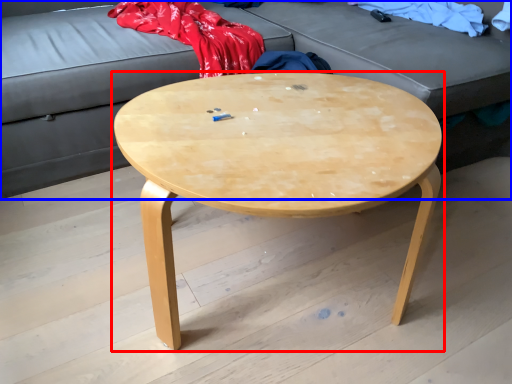
Question: Which point is closer to the camera, coffee table (highlighted by a red box) or studio couch (highlighted by a blue box)?

Choices:
 (A) coffee table
 (B) studio couch

Answer: (A)